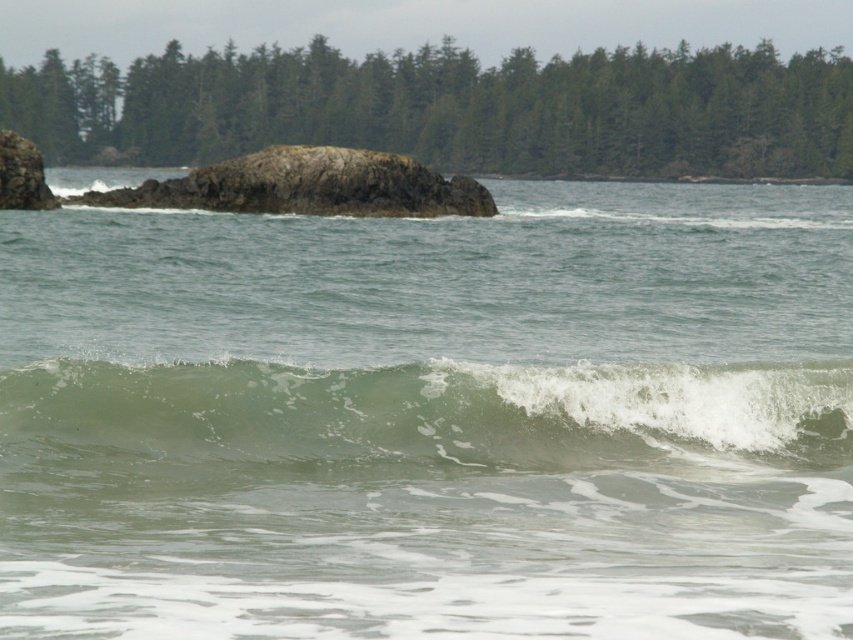
From the picture: You are a kayaker observing the greenish water at wave center and the green translucent water at center. Which body of water is higher in elevation?

The greenish water at wave center is taller than the green translucent water at center, so the greenish water at wave center has a higher elevation.

You are standing on the beach and see the point at coordinates (428,417) in the image. What is located at that point?

The point at coordinates (428,417) corresponds to green translucent water at center.